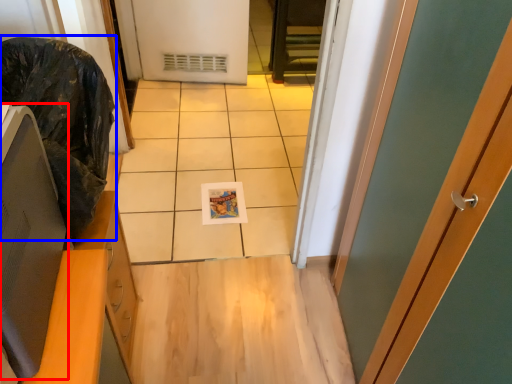
Question: Which point is further to the camera, computer monitor (highlighted by a red box) or garbage (highlighted by a blue box)?

Choices:
 (A) computer monitor
 (B) garbage

Answer: (B)